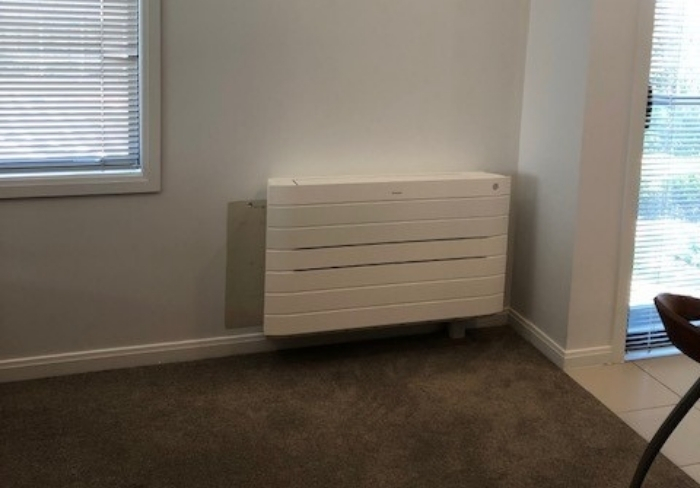
Where is `heating/ac unit`? This screenshot has height=488, width=700. heating/ac unit is located at coordinates (407, 219).